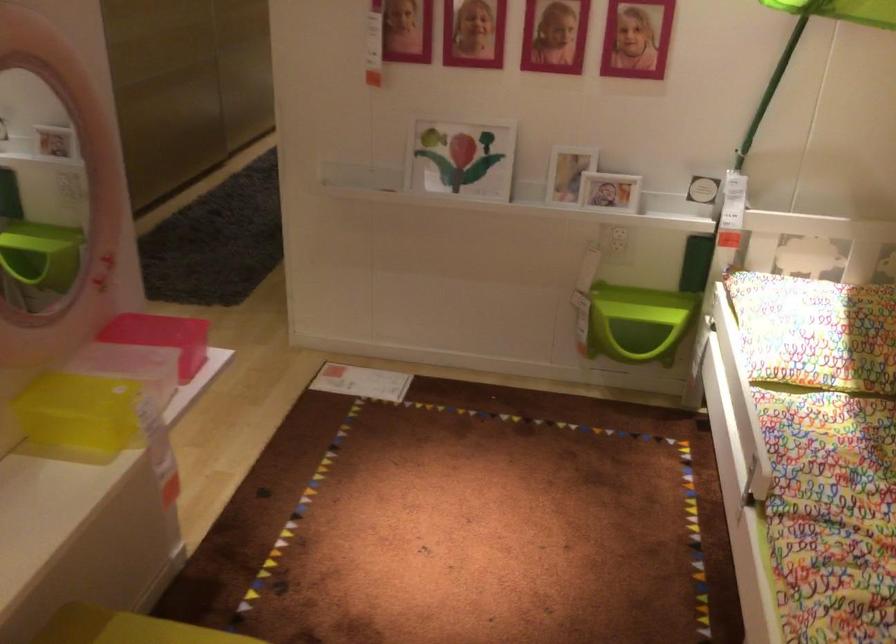
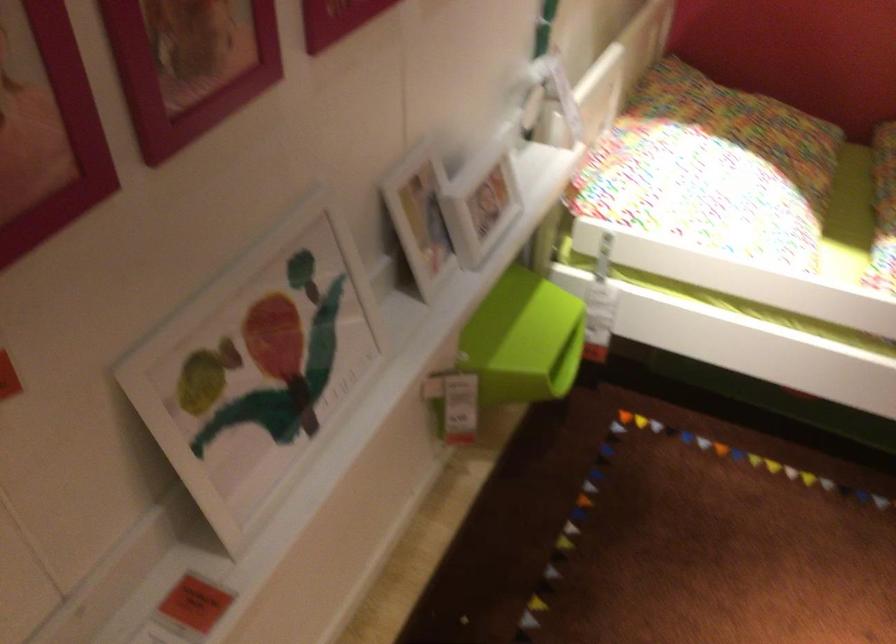
Find the pixel in the second image that matches (x=599, y=187) in the first image.

(479, 200)